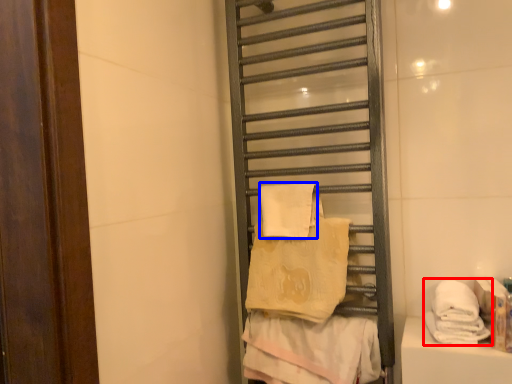
Question: Which object is further to the camera taking this photo, towel (highlighted by a red box) or towel (highlighted by a blue box)?

Choices:
 (A) towel
 (B) towel

Answer: (B)